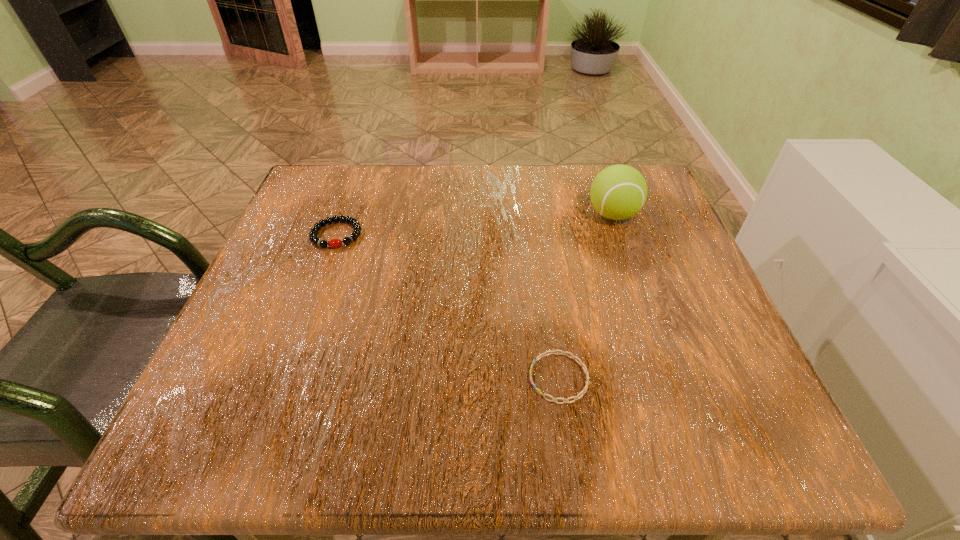
This screenshot has height=540, width=960. Identify the location of free space that is in between the left bracelet and the tallest object. (475, 225).

The height and width of the screenshot is (540, 960). I want to click on free point between the leftmost object and the rightmost object, so click(475, 225).

Identify the location of free space that is in between the nearer bracelet and the tennis ball. The image size is (960, 540). (586, 296).

This screenshot has width=960, height=540. In order to click on empty space that is in between the leftmost object and the tennis ball in this screenshot , I will do `click(475, 225)`.

Locate an element on the screen. The image size is (960, 540). blank region between the left bracelet and the tallest object is located at coordinates (475, 225).

Identify which object is located as the nearest to the right bracelet. Please provide its 2D coordinates. Your answer should be formatted as a tuple, i.e. [(x, y)], where the tuple contains the x and y coordinates of a point satisfying the conditions above.

[(618, 192)]

Identify which object is located as the second nearest to the nearest object. Please provide its 2D coordinates. Your answer should be formatted as a tuple, i.e. [(x, y)], where the tuple contains the x and y coordinates of a point satisfying the conditions above.

[(355, 224)]

Locate an element on the screen. free space that satisfies the following two spatial constraints: 1. on the back side of the tallest object; 2. on the left side of the leftmost object is located at coordinates (344, 214).

Locate an element on the screen. vacant area in the image that satisfies the following two spatial constraints: 1. on the front side of the tennis ball; 2. on the surface of the nearest object showing star-shaped elements is located at coordinates tap(670, 378).